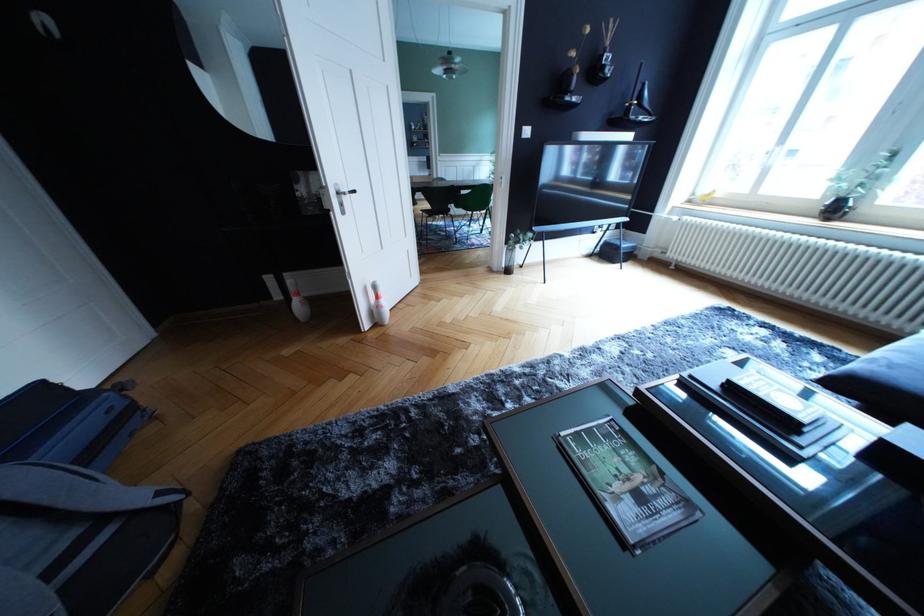
Locate an element on the screen. white door handle is located at coordinates (334, 197).